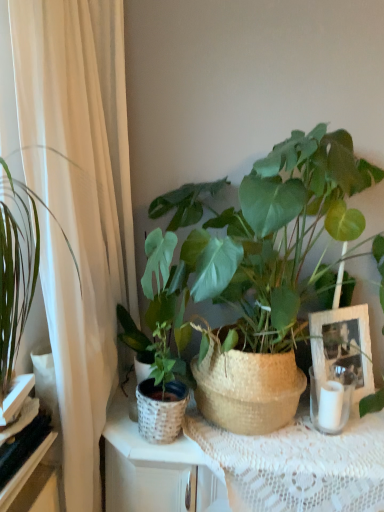
In order to click on vacant area located to the right-hand side of white glass candle holder at right in this screenshot , I will do `click(364, 428)`.